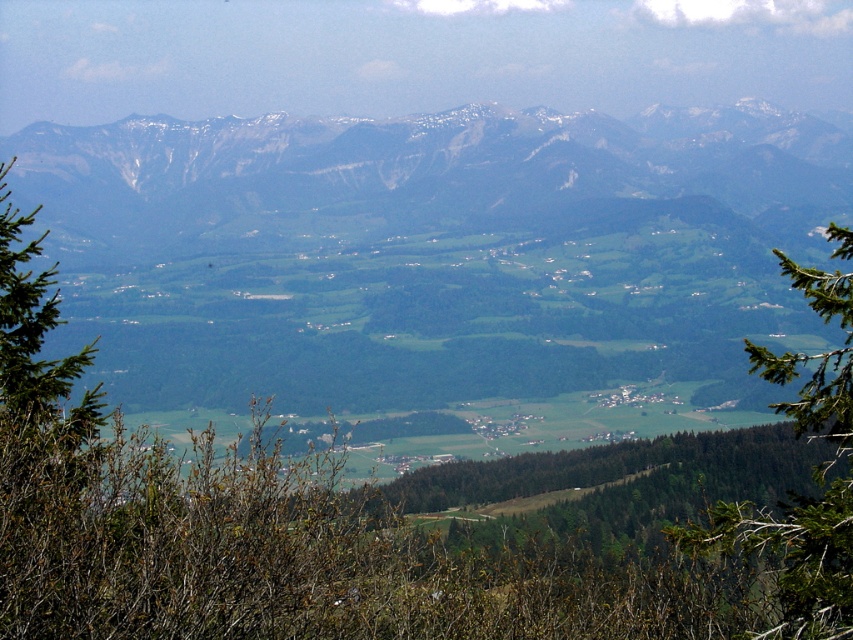
Is the position of snowy rocky mountain range at upper center less distant than that of green leafy tree at center-right?

No, snowy rocky mountain range at upper center is behind green leafy tree at center-right.

Between snowy rocky mountain range at upper center and green leafy tree at center-right, which one is positioned higher?

snowy rocky mountain range at upper center is above.

Find the location of a particular element. snowy rocky mountain range at upper center is located at coordinates (428, 161).

This screenshot has width=853, height=640. In order to click on snowy rocky mountain range at upper center in this screenshot , I will do `click(428, 161)`.